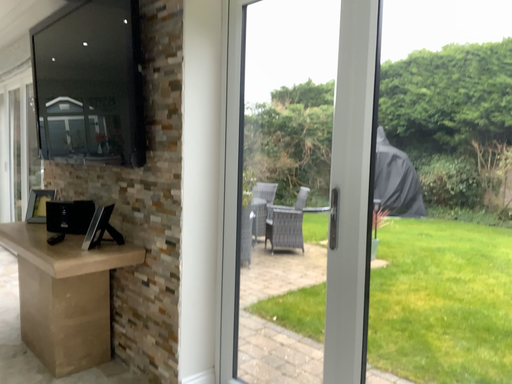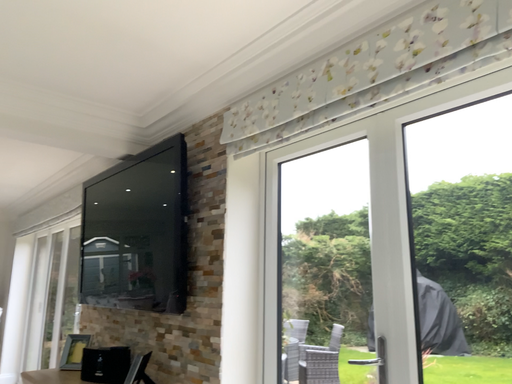
Question: Which way did the camera rotate in the video?

Choices:
 (A) rotated upward
 (B) rotated downward

Answer: (A)